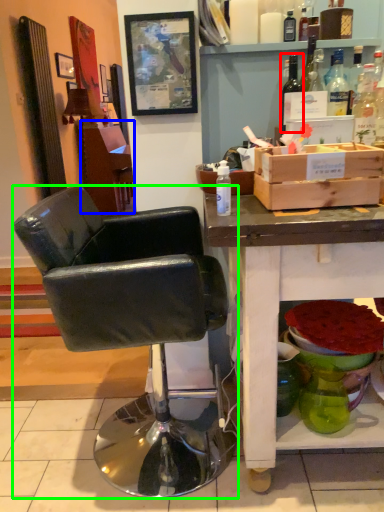
Question: Considering the real-world distances, which object is closest to bottle (highlighted by a red box)? vanity (highlighted by a blue box) or chair (highlighted by a green box).

Choices:
 (A) vanity
 (B) chair

Answer: (B)